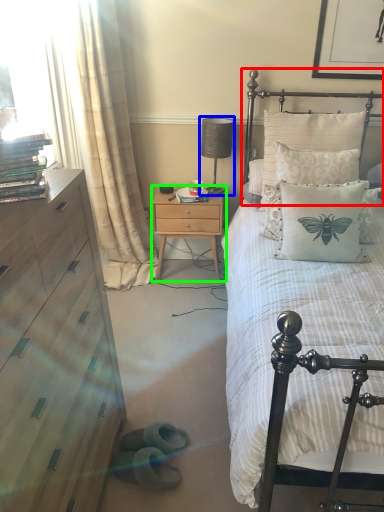
Question: Considering the real-world distances, which object is closest to headboard (highlighted by a red box)? table lamp (highlighted by a blue box) or nightstand (highlighted by a green box).

Choices:
 (A) table lamp
 (B) nightstand

Answer: (A)